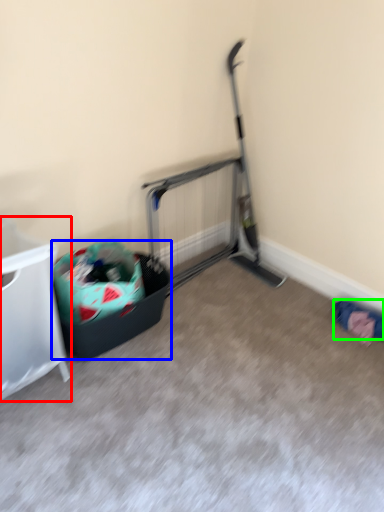
Question: Estimate the real-world distances between objects in this image. Which object is farther from furniture (highlighted by a red box), recycling bin (highlighted by a blue box) or clothing (highlighted by a green box)?

Choices:
 (A) recycling bin
 (B) clothing

Answer: (B)